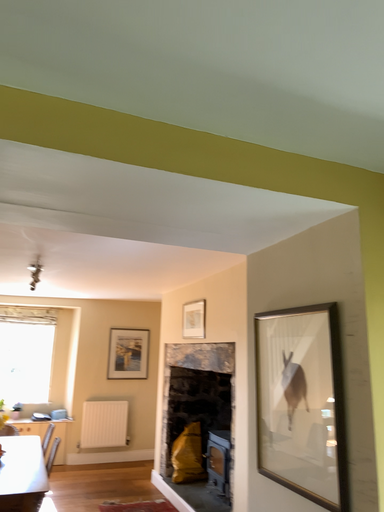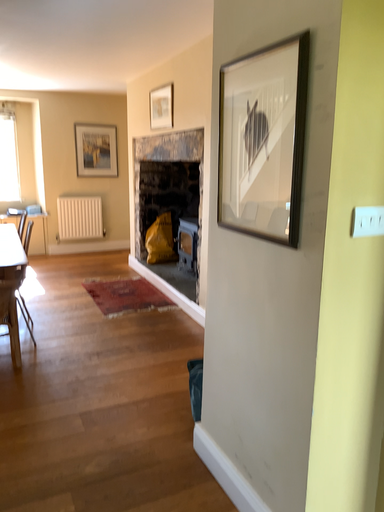
Question: How did the camera likely rotate when shooting the video?

Choices:
 (A) rotated downward
 (B) rotated upward

Answer: (A)